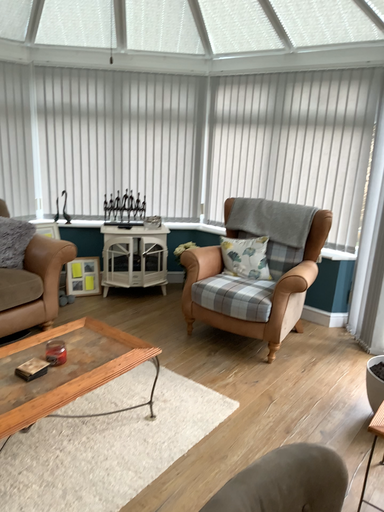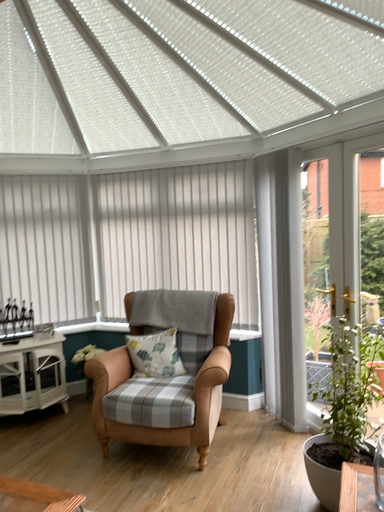
Question: How did the camera likely rotate when shooting the video?

Choices:
 (A) rotated left
 (B) rotated right

Answer: (B)